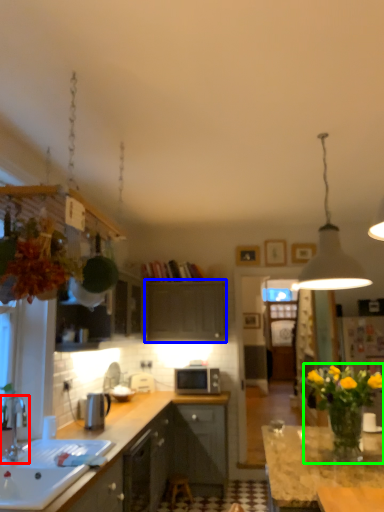
Question: Estimate the real-world distances between objects in this image. Which object is farther from tap (highlighted by a red box), cabinetry (highlighted by a blue box) or floral arrangement (highlighted by a green box)?

Choices:
 (A) cabinetry
 (B) floral arrangement

Answer: (A)